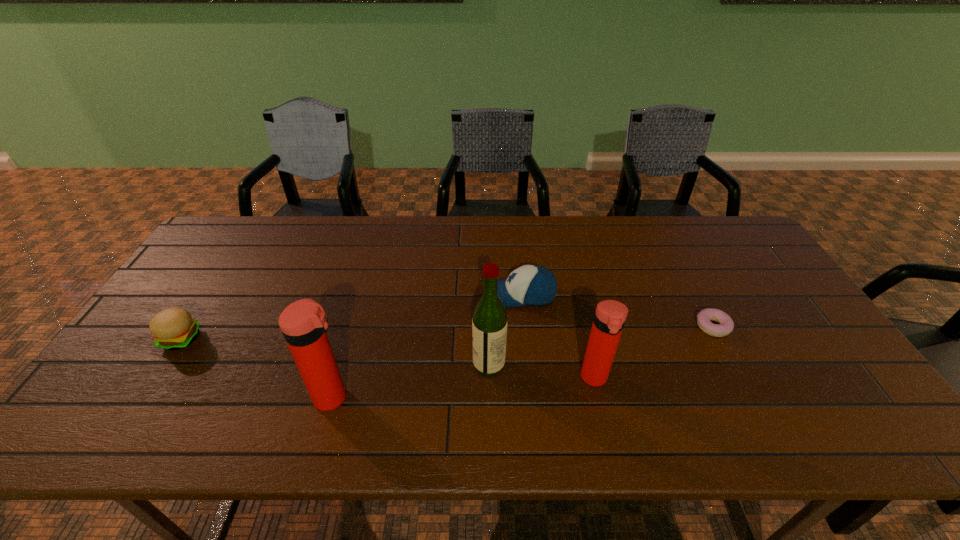
At what (x,y) coordinates should I click in order to perform the action: click on the taller thermos bottle. Please return your answer as a coordinate pair (x, y). The image size is (960, 540). Looking at the image, I should click on (304, 324).

The image size is (960, 540). Identify the location of the second object from left to right. (304, 324).

Locate an element on the screen. This screenshot has width=960, height=540. the fifth object from left to right is located at coordinates (610, 316).

Locate an element on the screen. Image resolution: width=960 pixels, height=540 pixels. the shorter thermos bottle is located at coordinates (610, 316).

In order to click on the shortest object in this screenshot , I will do `click(726, 324)`.

What are the coordinates of `doughnut` in the screenshot? It's located at (726, 324).

Where is `the third shortest object`? Image resolution: width=960 pixels, height=540 pixels. the third shortest object is located at coordinates (532, 285).

Identify the location of baseball cap. This screenshot has height=540, width=960. (532, 285).

Where is `hamburger`? The width and height of the screenshot is (960, 540). hamburger is located at coordinates (173, 328).

You are a GUI agent. You are given a task and a screenshot of the screen. Output one action in this format:
    pyautogui.click(x=<x>, y=<y>)
    Task: Click on the fifth tallest object
    
    Given the screenshot: What is the action you would take?
    pyautogui.click(x=173, y=328)